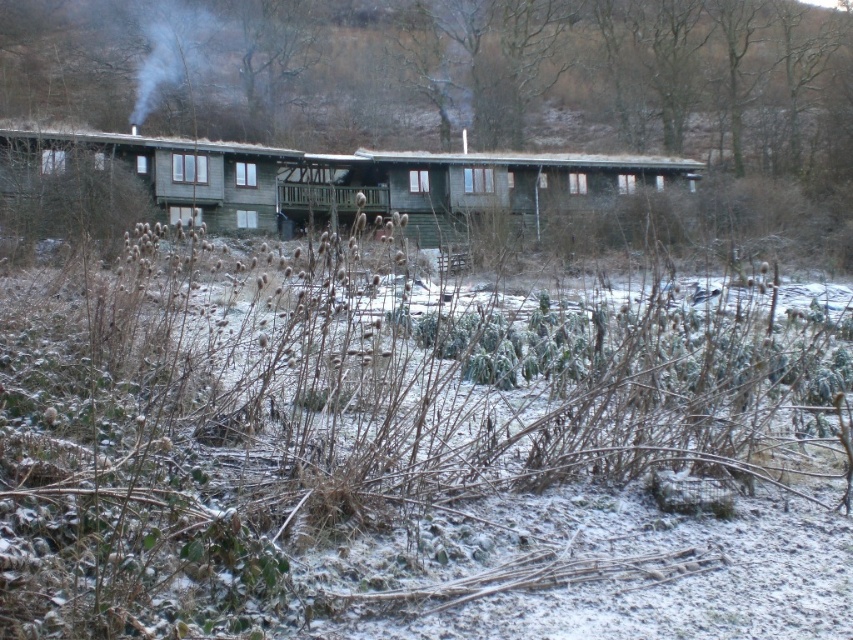
Question: Among these points, which one is farthest from the camera?

Choices:
 (A) pyautogui.click(x=262, y=209)
 (B) pyautogui.click(x=418, y=200)

Answer: (B)

Question: Can you confirm if green wood cabin at center is bigger than green wooden hut at left?

Choices:
 (A) no
 (B) yes

Answer: (B)

Question: Which object appears closest to the camera in this image?

Choices:
 (A) green wooden hut at left
 (B) green wood cabin at center

Answer: (B)

Question: Does green wood cabin at center appear on the left side of green wooden hut at left?

Choices:
 (A) yes
 (B) no

Answer: (B)

Question: Does green wood cabin at center have a greater width compared to green wooden hut at left?

Choices:
 (A) no
 (B) yes

Answer: (B)

Question: Which point appears closest to the camera in this image?

Choices:
 (A) (271, 168)
 (B) (409, 164)

Answer: (A)